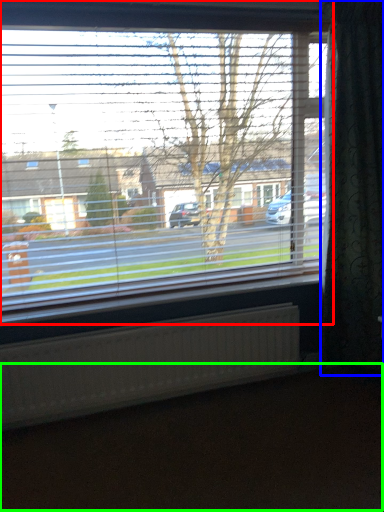
Question: Considering the real-world distances, which object is closest to window (highlighted by a red box)? curtain (highlighted by a blue box) or dirt track (highlighted by a green box).

Choices:
 (A) curtain
 (B) dirt track

Answer: (A)